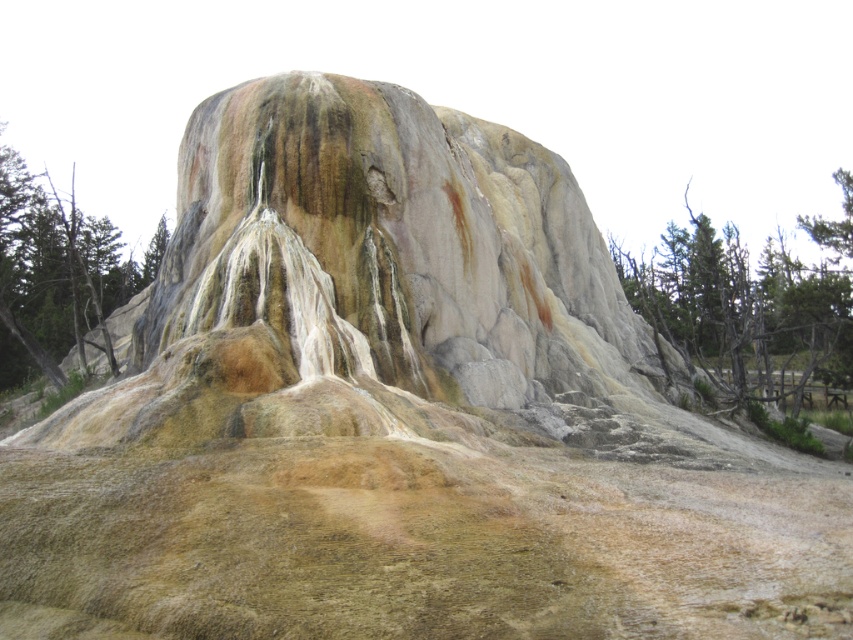
You are standing at the base of the geothermal mound and want to reach the point marked at coordinates point [711,340]. If your maximum comfortable walking distance is 50 meters, can you comfortably reach that point without straining?

The point [711,340] is 48.58 meters away from the viewer, so yes, you can comfortably reach it within your 50 meters limit.

You are standing in front of the geothermal mound and want to take a photo of the green rough bark tree at left without the green leafy trees at upper right blocking the view. Is this possible?

The green rough bark tree at left is behind the green leafy trees at upper right, so it is blocked by them. Therefore, you cannot take a photo of the green rough bark tree at left without the green leafy trees at upper right blocking the view.